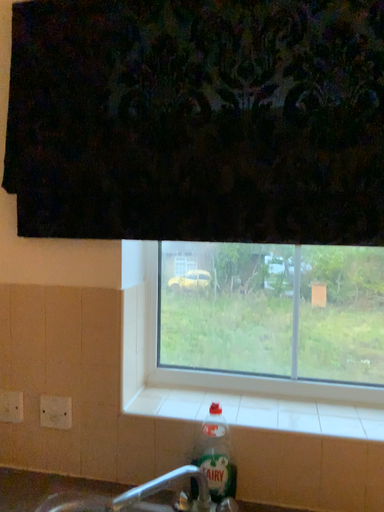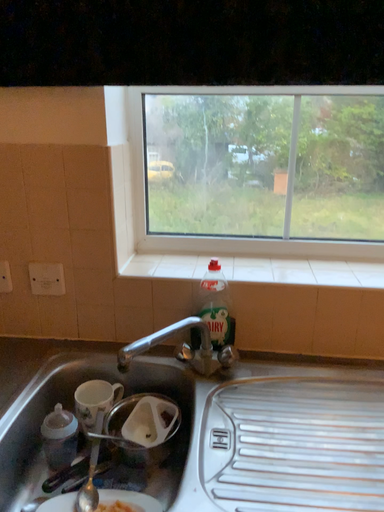
Question: How did the camera likely rotate when shooting the video?

Choices:
 (A) rotated downward
 (B) rotated upward

Answer: (A)